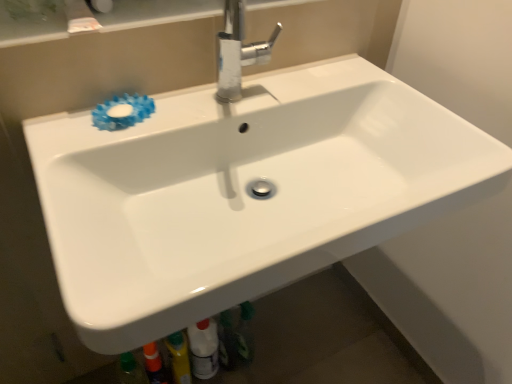
Image resolution: width=512 pixels, height=384 pixels. I want to click on free spot to the right of blue rubber flower at upper left, so click(x=205, y=110).